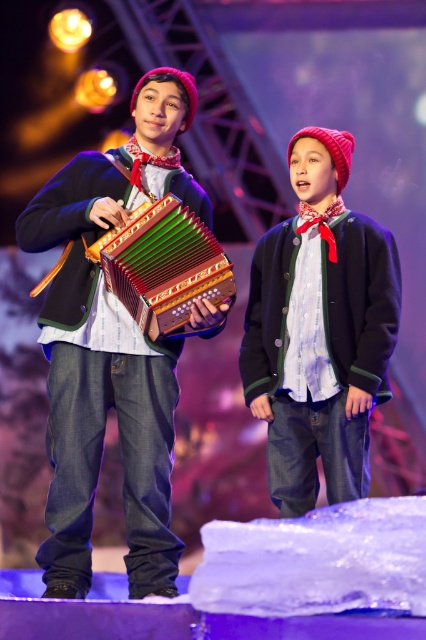
Is matte black accordion at center positioned in front of wooden textured accordion at center?

Yes, it is in front of wooden textured accordion at center.

The height and width of the screenshot is (640, 426). What do you see at coordinates (111, 348) in the screenshot?
I see `matte black accordion at center` at bounding box center [111, 348].

In order to click on matte black accordion at center in this screenshot , I will do click(111, 348).

Locate an element on the screen. This screenshot has height=640, width=426. matte black accordion at center is located at coordinates (111, 348).

Describe the element at coordinates (319, 330) in the screenshot. I see `matte black sweater at center` at that location.

Is matte black sweater at center above wooden textured accordion at center?

No.

Which is in front, point (322, 225) or point (108, 246)?

Point (108, 246) is in front.

Locate an element on the screen. matte black sweater at center is located at coordinates (319, 330).

Can you confirm if matte black accordion at center is wider than matte black sweater at center?

Correct, the width of matte black accordion at center exceeds that of matte black sweater at center.

Who is positioned more to the right, matte black accordion at center or matte black sweater at center?

matte black sweater at center

Image resolution: width=426 pixels, height=640 pixels. What are the coordinates of `matte black accordion at center` in the screenshot? It's located at (111, 348).